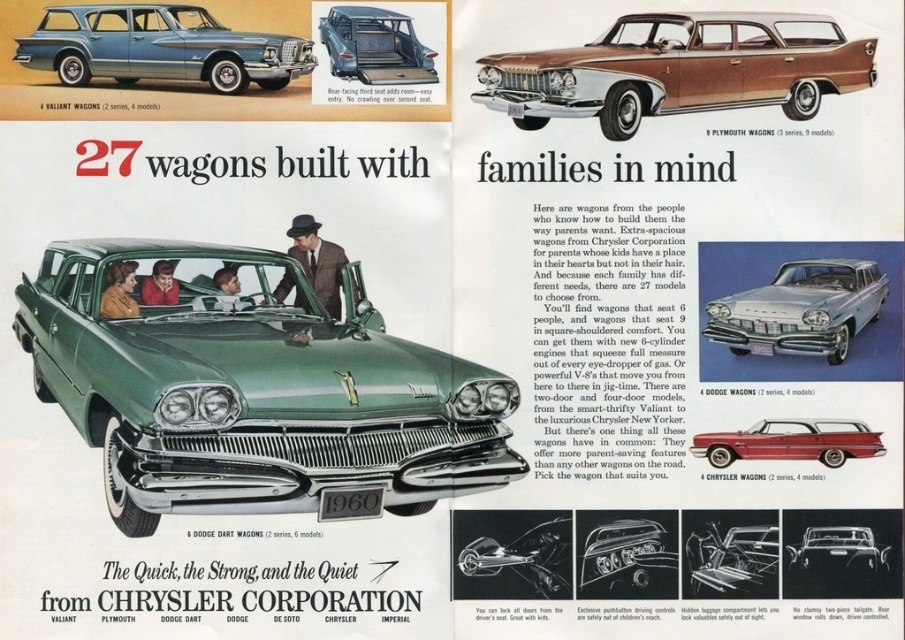
What is the relationship between the green metallic wagon at center and the shiny chrome handle at center in the advertisement?

The green metallic wagon at center is positioned over the shiny chrome handle at center.

From the picture: You are a delivery person who needs to park a delivery van that is 2 meters wide. You see the silver metallic sedan at center and the metallic blue wagon at upper center in the parking lot. Can you determine if there is enough space between them to park your van?

The silver metallic sedan at center might be wider than metallic blue wagon at upper center, so there may not be enough space between them to park a 2 meter wide van. Check the actual width before proceeding.